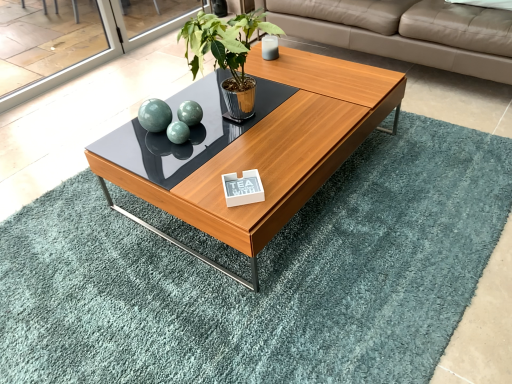
Find the location of a particular element. The height and width of the screenshot is (384, 512). empty space that is in between green leafy plant at center and white glossy plaque at center is located at coordinates click(x=247, y=158).